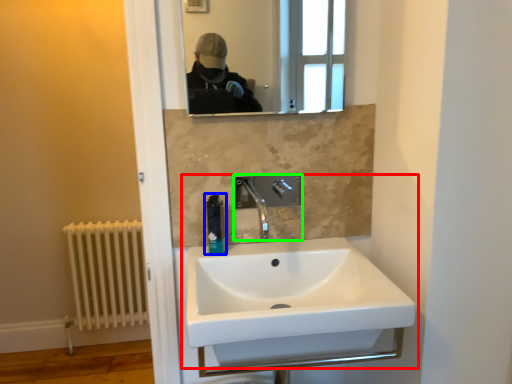
Question: Estimate the real-world distances between objects in this image. Which object is closer to sink (highlighted by a red box), soap dispenser (highlighted by a blue box) or tap (highlighted by a green box)?

Choices:
 (A) soap dispenser
 (B) tap

Answer: (B)